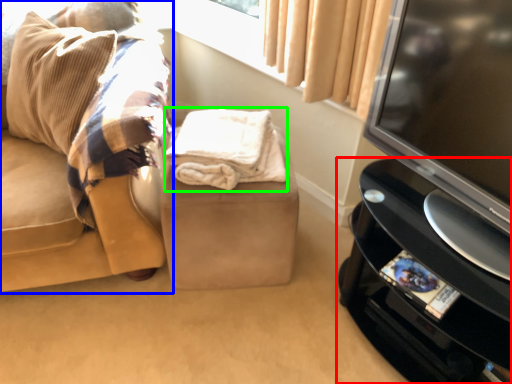
Question: Which is nearer to the furniture (highlighted by a red box)? studio couch (highlighted by a blue box) or blanket (highlighted by a green box).

Choices:
 (A) studio couch
 (B) blanket

Answer: (B)